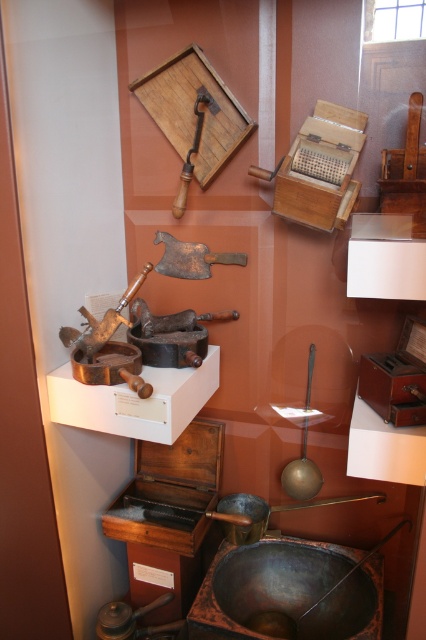
What object is located at the coordinates point (190, 257) in the display case?

The brass or bronze axe is located at point (190, 257) in the display case.